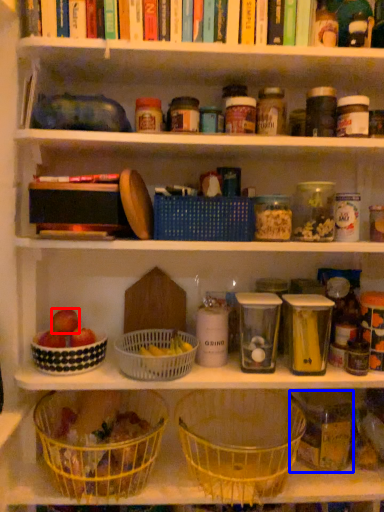
Question: Among these objects, which one is farthest to the camera, apple (highlighted by a red box) or glass jar (highlighted by a blue box)?

Choices:
 (A) apple
 (B) glass jar

Answer: (A)